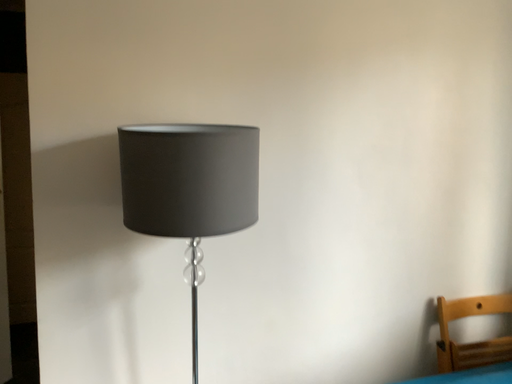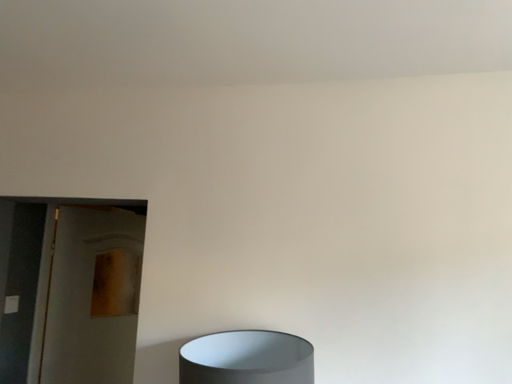
Question: Which way did the camera rotate in the video?

Choices:
 (A) rotated upward
 (B) rotated downward

Answer: (A)